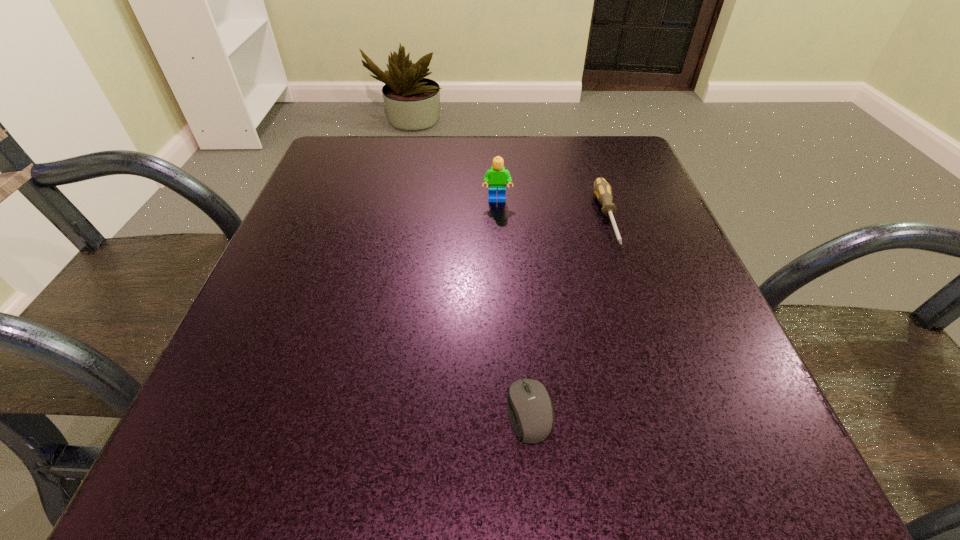
Image resolution: width=960 pixels, height=540 pixels. I want to click on Lego, so click(x=497, y=177).

Where is `the second tallest object`? the second tallest object is located at coordinates (602, 190).

In order to click on the rightmost object in this screenshot , I will do `click(602, 190)`.

Find the location of a particular element. This screenshot has width=960, height=540. the nearest object is located at coordinates (530, 410).

Where is `computer equipment`? The width and height of the screenshot is (960, 540). computer equipment is located at coordinates (530, 410).

You are a GUI agent. You are given a task and a screenshot of the screen. Output one action in this format:
    pyautogui.click(x=<x>, y=<y>)
    Task: Click on the vacant space located 0.150m on the face of the tallest object
    Image resolution: width=960 pixels, height=540 pixels.
    Given the screenshot: What is the action you would take?
    pyautogui.click(x=499, y=253)

Image resolution: width=960 pixels, height=540 pixels. In order to click on vacant space located at the tip of the screwdriver in this screenshot , I will do `click(645, 331)`.

Identify the location of blank area located 0.110m on the back of the nearest object. This screenshot has height=540, width=960. (521, 320).

At what (x,y) coordinates should I click in order to perform the action: click on object located in the far edge section of the desktop. Please return your answer as a coordinate pair (x, y). The image size is (960, 540). Looking at the image, I should click on click(x=602, y=190).

Image resolution: width=960 pixels, height=540 pixels. In order to click on object that is at the near edge in this screenshot , I will do `click(530, 410)`.